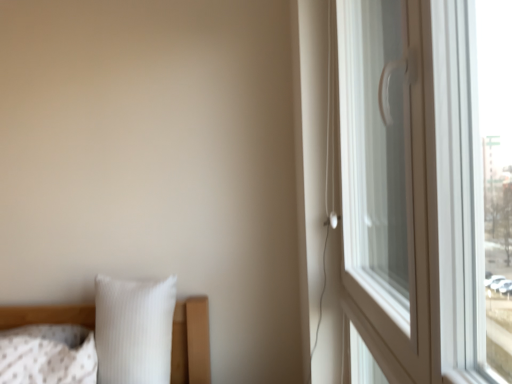
Question: Is point (431, 72) positioned closer to the camera than point (90, 357)?

Choices:
 (A) closer
 (B) farther

Answer: (A)

Question: Is white glossy window handle at right to the left or to the right of white textured pillow at lower left, the 2th pillow in the right-to-left sequence, in the image?

Choices:
 (A) right
 (B) left

Answer: (A)

Question: Which is farther from the white ribbed pillow at lower left, which is counted as the first pillow, starting from the right?

Choices:
 (A) white textured pillow at lower left, the 2th pillow in the right-to-left sequence
 (B) white glossy window handle at right

Answer: (B)

Question: Estimate the real-world distances between objects in this image. Which object is farther from the white textured pillow at lower left, the 2th pillow in the right-to-left sequence?

Choices:
 (A) white ribbed pillow at lower left, which appears as the second pillow when viewed from the left
 (B) white glossy window handle at right

Answer: (B)